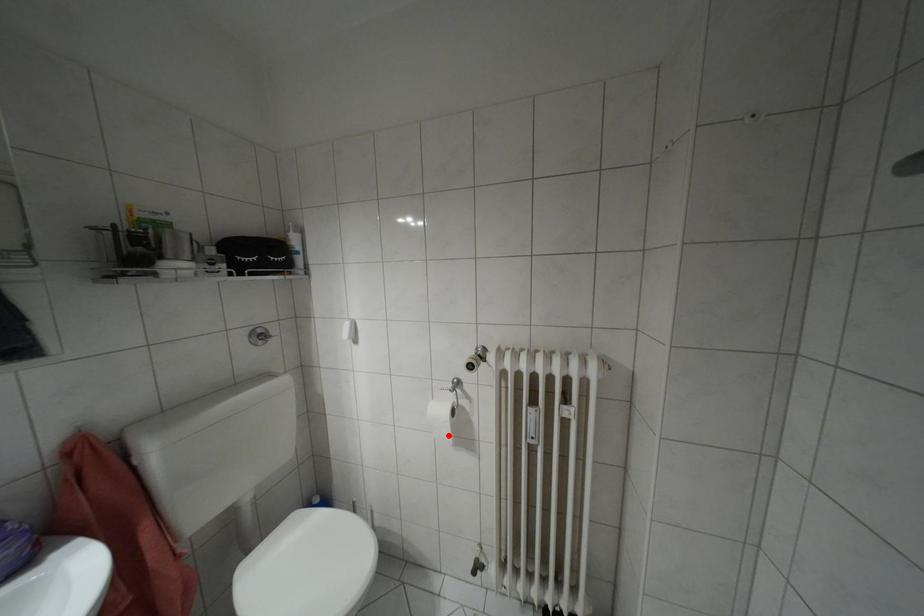
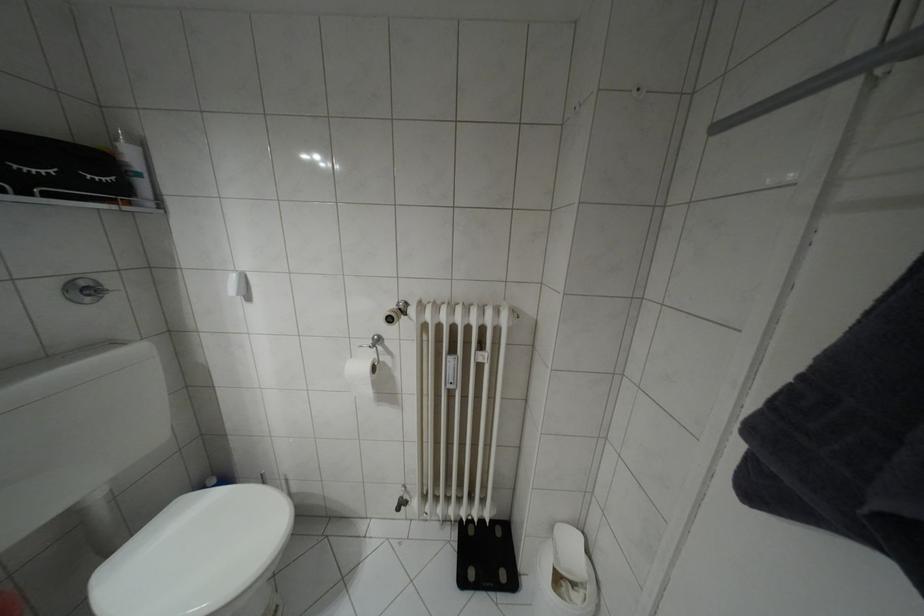
The point at the highlighted location is marked in the first image. Where is the corresponding point in the second image?

(369, 392)